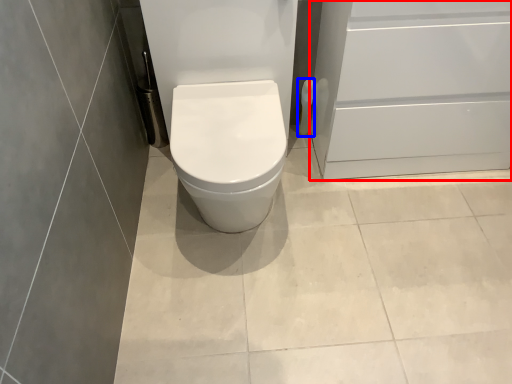
Question: Which point is closer to the camera, screen door (highlighted by a red box) or toilet paper (highlighted by a blue box)?

Choices:
 (A) screen door
 (B) toilet paper

Answer: (A)